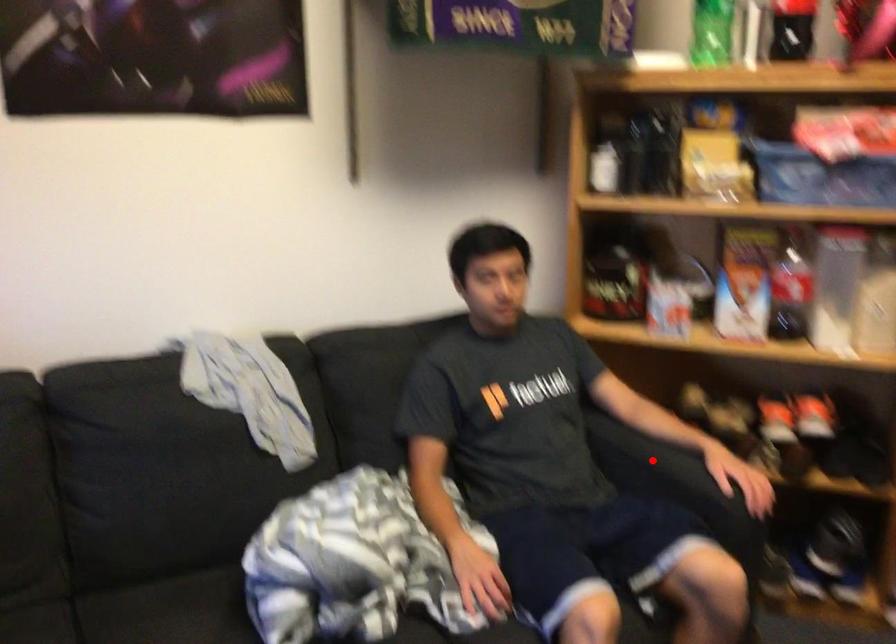
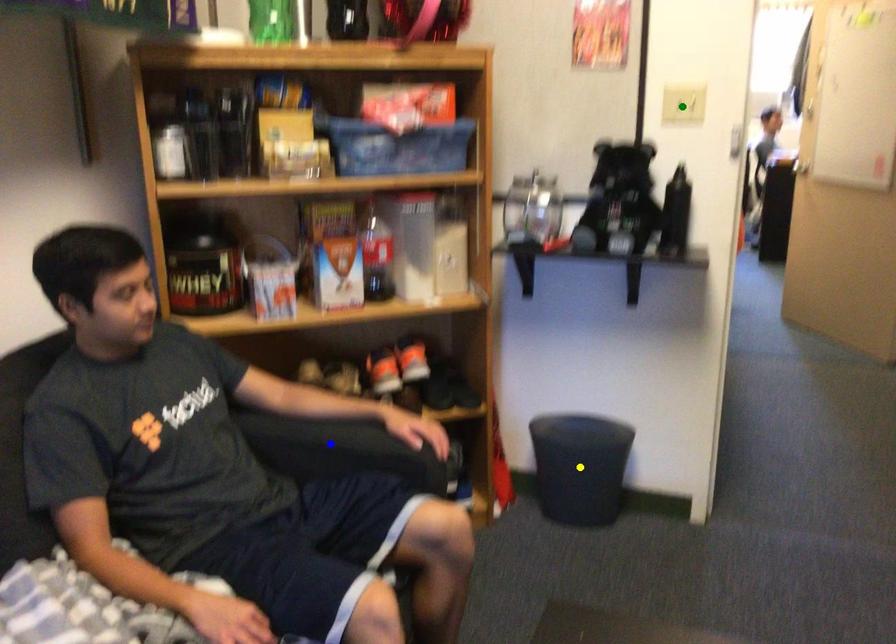
Question: I am providing you with two images of the same scene from different viewpoints. A red point is marked on the first image. You are given multiple points on the second image. Which point in image 2 is actually the same real-world point as the red point in image 1?

Choices:
 (A) green point
 (B) blue point
 (C) yellow point

Answer: (B)